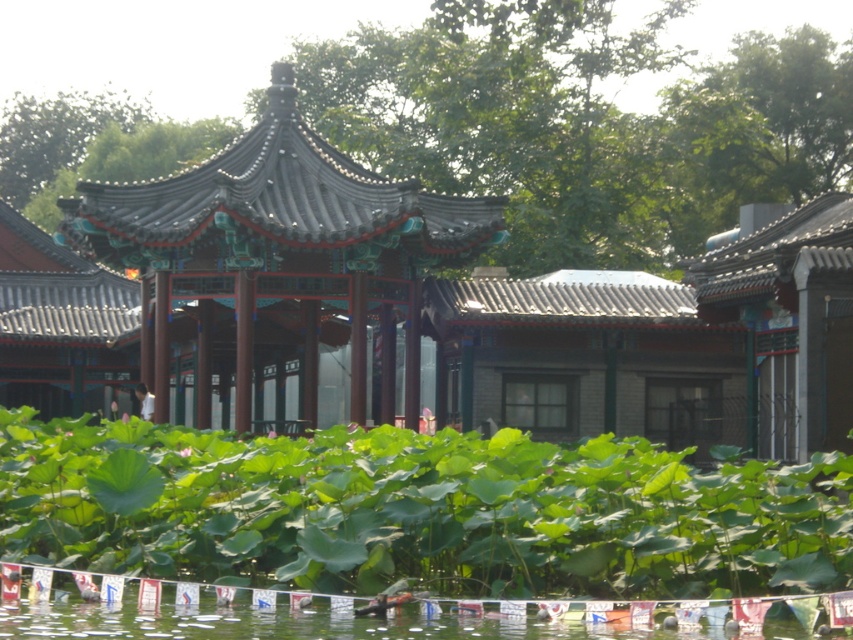
Image resolution: width=853 pixels, height=640 pixels. What do you see at coordinates (416, 512) in the screenshot? I see `green leafy plants at center` at bounding box center [416, 512].

Is green leafy plants at center closer to camera compared to shiny dark gray gazebo at center?

Yes, it is in front of shiny dark gray gazebo at center.

Find the location of a particular element. green leafy plants at center is located at coordinates pos(416,512).